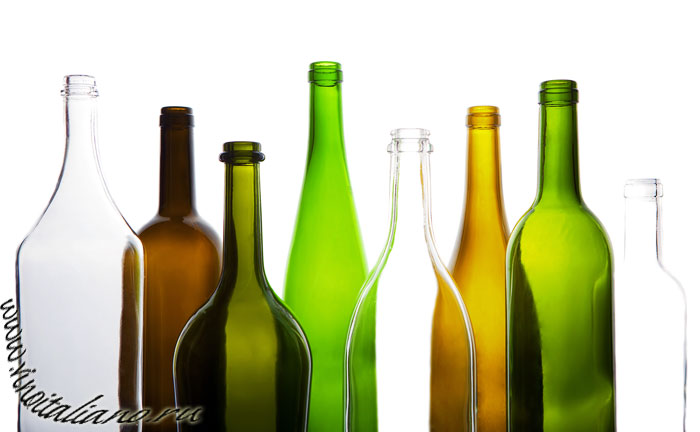
Locate an element on the screen. This screenshot has width=700, height=432. bottles on the right side is located at coordinates (640, 329), (566, 319), (484, 301), (424, 339).